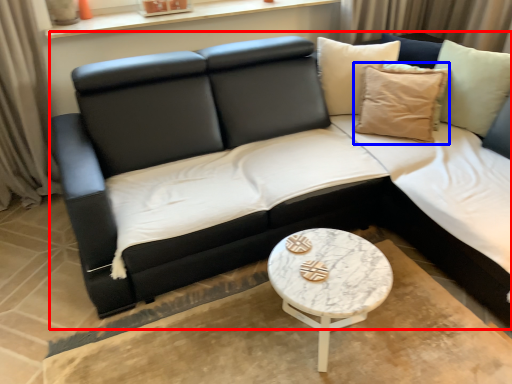
Question: Which of the following is the farthest to the observer, studio couch (highlighted by a red box) or pillow (highlighted by a blue box)?

Choices:
 (A) studio couch
 (B) pillow

Answer: (B)